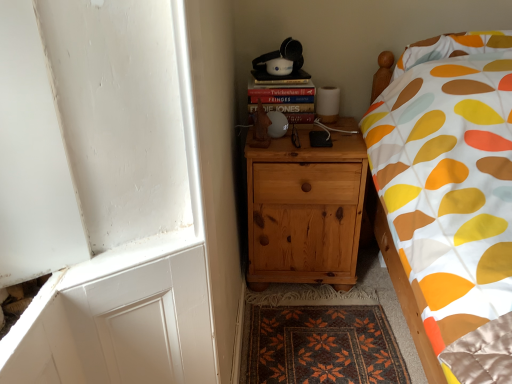
Question: From a real-world perspective, is dark brown woven mat at lower center positioned above or below wooden statue at center?

Choices:
 (A) above
 (B) below

Answer: (B)

Question: Is dark brown woven mat at lower center in front of or behind wooden statue at center in the image?

Choices:
 (A) behind
 (B) front

Answer: (B)

Question: Based on their relative distances, which object is nearer to the hardcover book at upper right?

Choices:
 (A) wooden statue at center
 (B) natural wood nightstand at center
 (C) dark brown woven mat at lower center

Answer: (A)

Question: Considering the real-world distances, which object is closest to the wooden statue at center?

Choices:
 (A) natural wood nightstand at center
 (B) dark brown woven mat at lower center
 (C) hardcover book at upper right

Answer: (C)